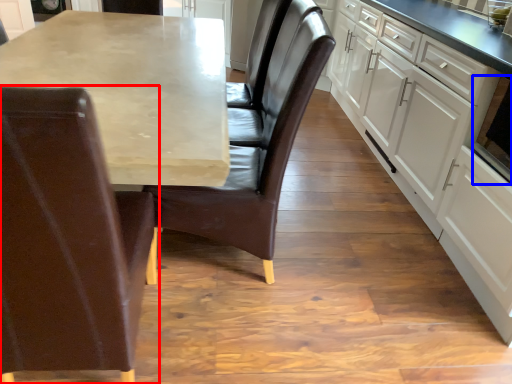
Question: Which object is closer to the camera taking this photo, chair (highlighted by a red box) or appliance (highlighted by a blue box)?

Choices:
 (A) chair
 (B) appliance

Answer: (A)